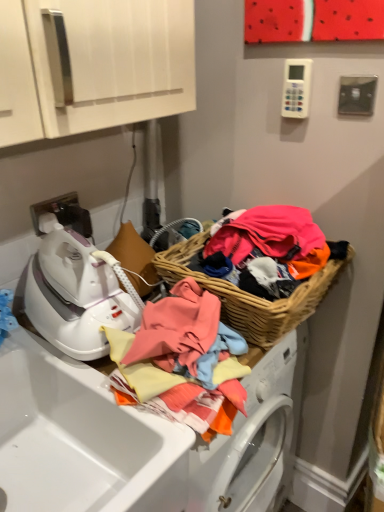
Question: Are white glossy iron at left and white glossy sink at lower left beside each other?

Choices:
 (A) no
 (B) yes

Answer: (A)

Question: Is white glossy iron at left not within white glossy sink at lower left?

Choices:
 (A) yes
 (B) no

Answer: (A)

Question: Could you tell me if white glossy iron at left is turned towards white glossy sink at lower left?

Choices:
 (A) yes
 (B) no

Answer: (B)

Question: Is white glossy iron at left not close to white glossy sink at lower left?

Choices:
 (A) yes
 (B) no

Answer: (B)

Question: Is white glossy iron at left facing away from white glossy sink at lower left?

Choices:
 (A) yes
 (B) no

Answer: (B)

Question: From their relative heights in the image, would you say woven wood basket at right is taller or shorter than white glossy iron at left?

Choices:
 (A) short
 (B) tall

Answer: (A)

Question: Considering the positions of woven wood basket at right and white glossy iron at left in the image, is woven wood basket at right bigger or smaller than white glossy iron at left?

Choices:
 (A) big
 (B) small

Answer: (A)

Question: Looking at their shapes, would you say woven wood basket at right is wider or thinner than white glossy iron at left?

Choices:
 (A) thin
 (B) wide

Answer: (A)

Question: From the image's perspective, is woven wood basket at right above or below white glossy iron at left?

Choices:
 (A) above
 (B) below

Answer: (A)

Question: Looking at their shapes, would you say woven wood basket at right is wider or thinner than white glossy sink at lower left?

Choices:
 (A) thin
 (B) wide

Answer: (A)

Question: Relative to white glossy sink at lower left, is woven wood basket at right in front or behind?

Choices:
 (A) behind
 (B) front

Answer: (A)

Question: In terms of height, does woven wood basket at right look taller or shorter compared to white glossy sink at lower left?

Choices:
 (A) short
 (B) tall

Answer: (A)

Question: From a real-world perspective, is woven wood basket at right above or below white glossy sink at lower left?

Choices:
 (A) above
 (B) below

Answer: (A)

Question: Based on their positions, is white glossy sink at lower left located to the left or right of woven wood basket at right?

Choices:
 (A) left
 (B) right

Answer: (A)

Question: Is white glossy sink at lower left situated inside woven wood basket at right or outside?

Choices:
 (A) inside
 (B) outside

Answer: (B)